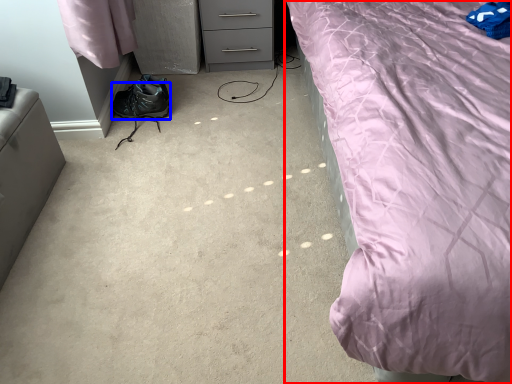
Question: Which of the following is the farthest to the observer, bed (highlighted by a red box) or shoe (highlighted by a blue box)?

Choices:
 (A) bed
 (B) shoe

Answer: (B)